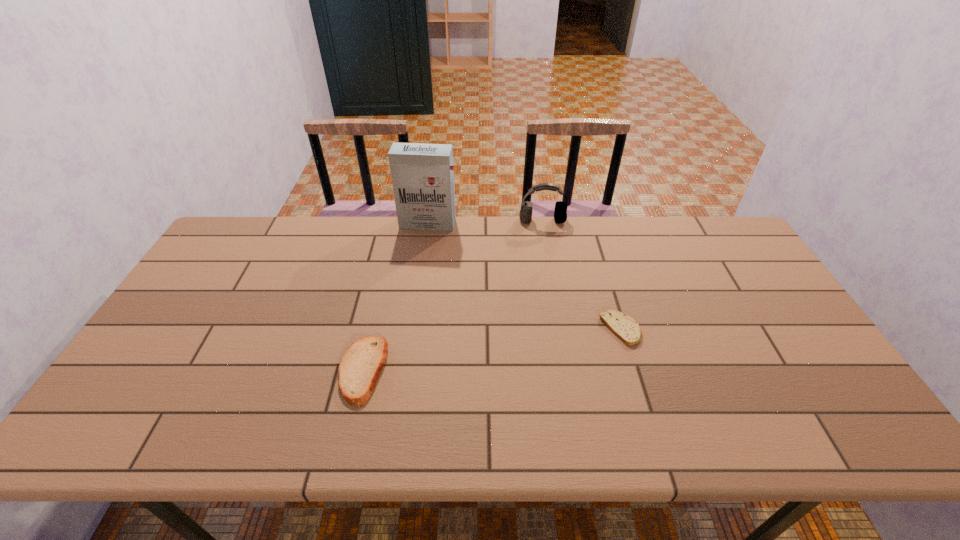
Locate an element on the screen. Image resolution: width=960 pixels, height=540 pixels. vacant space in between the second shortest object and the cigarette case is located at coordinates (396, 296).

Image resolution: width=960 pixels, height=540 pixels. I want to click on vacant area that lies between the shortest object and the second object from right to left, so pos(582,275).

The width and height of the screenshot is (960, 540). I want to click on free space between the left pita bread and the second tallest object, so click(452, 295).

The height and width of the screenshot is (540, 960). What are the coordinates of `free space between the left pita bread and the second object from right to left` in the screenshot? It's located at (452, 295).

Find the location of a particular element. free space between the rightmost object and the taller pita bread is located at coordinates (492, 349).

Locate an element on the screen. vacant area that lies between the headset and the taller pita bread is located at coordinates (452, 295).

The image size is (960, 540). I want to click on free area in between the shorter pita bread and the second tallest object, so click(582, 275).

What are the coordinates of `vacant space in between the second object from right to left and the cigarette case` in the screenshot? It's located at (485, 222).

You are a GUI agent. You are given a task and a screenshot of the screen. Output one action in this format:
    pyautogui.click(x=<x>, y=<y>)
    Task: Click on the unoccupied area between the cigarette case and the second tallest object
    The image size is (960, 540).
    Given the screenshot: What is the action you would take?
    pyautogui.click(x=485, y=222)

In order to click on object identified as the closest to the third shortest object in this screenshot , I will do `click(422, 175)`.